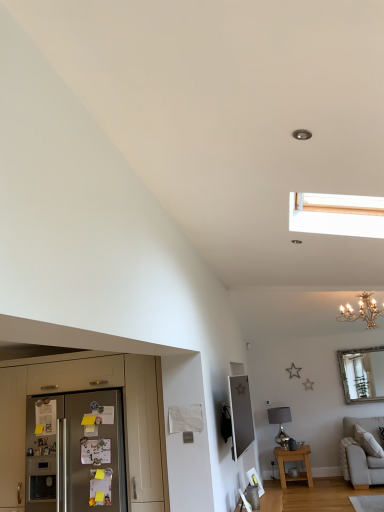
Question: Is stainless steel refrigerator at lower left bigger than beech wood side table at lower right?

Choices:
 (A) yes
 (B) no

Answer: (A)

Question: From the image's perspective, is stainless steel refrigerator at lower left located above beech wood side table at lower right?

Choices:
 (A) no
 (B) yes

Answer: (B)

Question: Is stainless steel refrigerator at lower left thinner than beech wood side table at lower right?

Choices:
 (A) no
 (B) yes

Answer: (A)

Question: Can you confirm if stainless steel refrigerator at lower left is taller than beech wood side table at lower right?

Choices:
 (A) no
 (B) yes

Answer: (B)

Question: From the image's perspective, is stainless steel refrigerator at lower left under beech wood side table at lower right?

Choices:
 (A) no
 (B) yes

Answer: (A)

Question: Does stainless steel refrigerator at lower left have a smaller size compared to beech wood side table at lower right?

Choices:
 (A) no
 (B) yes

Answer: (A)

Question: Is the depth of stainless steel refrigerator at lower left less than that of gold metallic chandelier at upper right?

Choices:
 (A) no
 (B) yes

Answer: (B)

Question: Is gold metallic chandelier at upper right at the back of stainless steel refrigerator at lower left?

Choices:
 (A) no
 (B) yes

Answer: (A)

Question: From the image's perspective, is stainless steel refrigerator at lower left on gold metallic chandelier at upper right?

Choices:
 (A) yes
 (B) no

Answer: (B)

Question: Is stainless steel refrigerator at lower left wider than gold metallic chandelier at upper right?

Choices:
 (A) yes
 (B) no

Answer: (B)

Question: Does stainless steel refrigerator at lower left appear on the left side of gold metallic chandelier at upper right?

Choices:
 (A) no
 (B) yes

Answer: (B)

Question: Is stainless steel refrigerator at lower left not within gold metallic chandelier at upper right?

Choices:
 (A) no
 (B) yes

Answer: (B)

Question: From the image's perspective, is satin silver refrigerator at lower left on beech wood side table at lower right?

Choices:
 (A) no
 (B) yes

Answer: (B)